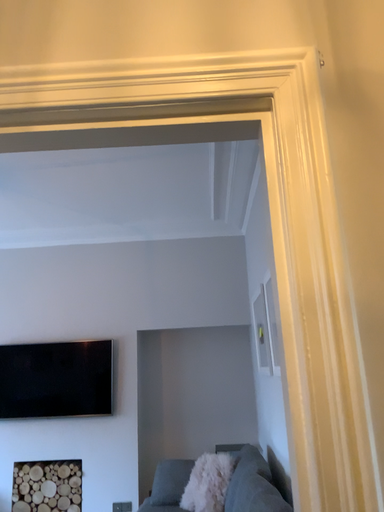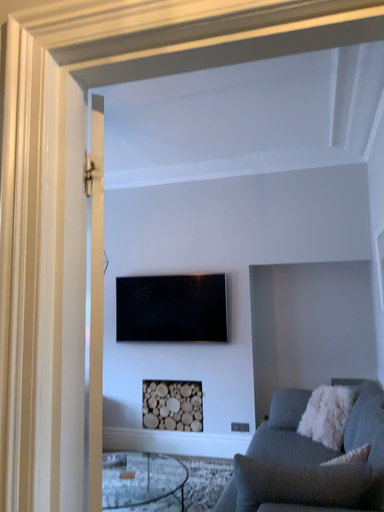
Question: Which way did the camera rotate in the video?

Choices:
 (A) rotated downward
 (B) rotated upward

Answer: (A)